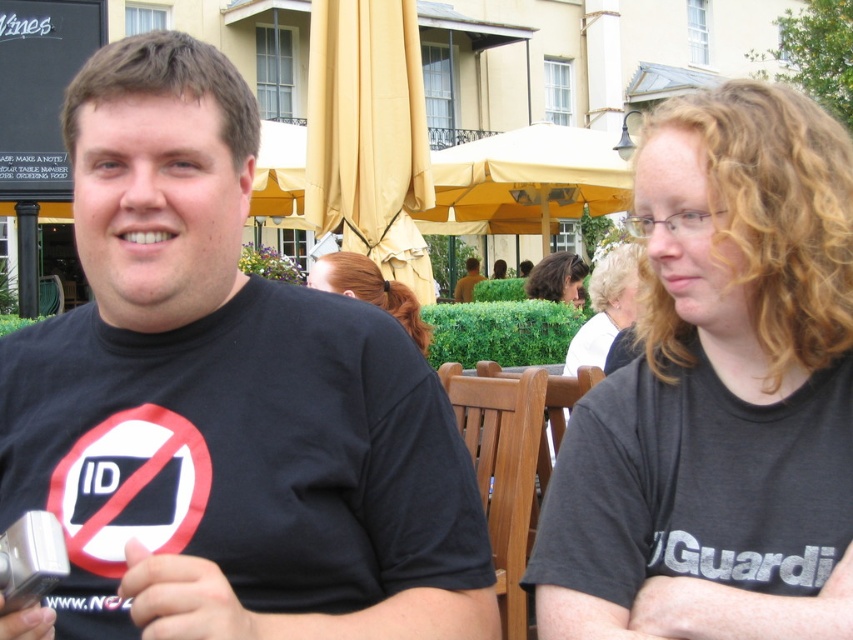
You are a photographer standing at the edge of the outdoor seating area. You want to take a photo of both the blonde hair at center and the brown leather jacket at center. Given that your camera has a maximum focus range of 30 meters, will you be able to capture both subjects in focus?

The distance between the blonde hair at center and the brown leather jacket at center is 29.15 meters, which is within the camera maximum focus range of 30 meters. Therefore, you can capture both subjects in focus.